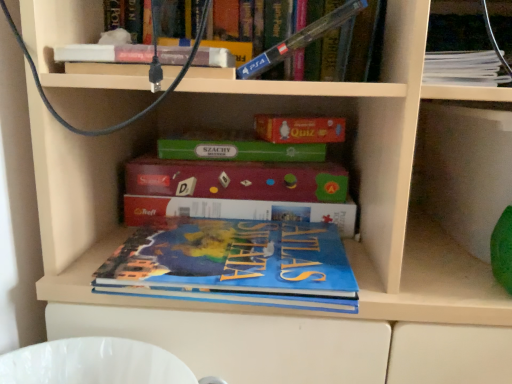
Question: Which direction should I rotate to look at blue matte atlas book at center, placed as the 1th book when sorted from bottom to top, — up or down?

Choices:
 (A) up
 (B) down

Answer: (B)

Question: Can you confirm if blue matte atlas book at center, placed as the 1th book when sorted from bottom to top, is taller than blue cardboard puzzle at center, arranged as the second book when ordered from the bottom?

Choices:
 (A) yes
 (B) no

Answer: (B)

Question: Does blue matte atlas book at center, positioned as the fourth book in top-to-bottom order, have a larger size compared to blue cardboard puzzle at center, the 3th book viewed from the top?

Choices:
 (A) no
 (B) yes

Answer: (B)

Question: Does blue matte atlas book at center, positioned as the fourth book in top-to-bottom order, come behind blue cardboard puzzle at center, the 3th book viewed from the top?

Choices:
 (A) no
 (B) yes

Answer: (A)

Question: Considering the relative sizes of blue matte atlas book at center, positioned as the fourth book in top-to-bottom order, and blue cardboard puzzle at center, the 3th book viewed from the top, in the image provided, is blue matte atlas book at center, positioned as the fourth book in top-to-bottom order, thinner than blue cardboard puzzle at center, the 3th book viewed from the top,?

Choices:
 (A) yes
 (B) no

Answer: (B)

Question: From a real-world perspective, is blue matte atlas book at center, placed as the 1th book when sorted from bottom to top, positioned under blue cardboard puzzle at center, arranged as the second book when ordered from the bottom, based on gravity?

Choices:
 (A) yes
 (B) no

Answer: (A)

Question: Is blue matte atlas book at center, placed as the 1th book when sorted from bottom to top, not within blue cardboard puzzle at center, arranged as the second book when ordered from the bottom?

Choices:
 (A) yes
 (B) no

Answer: (A)

Question: Is blue plastic ps4 controller at upper center, acting as the third book starting from the bottom, in front of white paper stack at upper right, which ranks as the fourth book in bottom-to-top order?

Choices:
 (A) yes
 (B) no

Answer: (A)

Question: Can you confirm if blue plastic ps4 controller at upper center, acting as the third book starting from the bottom, is taller than white paper stack at upper right, the 1th book viewed from the top?

Choices:
 (A) yes
 (B) no

Answer: (A)

Question: Does blue plastic ps4 controller at upper center, positioned as the second book in top-to-bottom order, appear on the right side of white paper stack at upper right, which ranks as the fourth book in bottom-to-top order?

Choices:
 (A) no
 (B) yes

Answer: (A)

Question: Is blue plastic ps4 controller at upper center, positioned as the second book in top-to-bottom order, further to the viewer compared to white paper stack at upper right, which ranks as the fourth book in bottom-to-top order?

Choices:
 (A) yes
 (B) no

Answer: (B)

Question: Can you confirm if blue plastic ps4 controller at upper center, positioned as the second book in top-to-bottom order, is wider than white paper stack at upper right, the 1th book viewed from the top?

Choices:
 (A) no
 (B) yes

Answer: (A)

Question: From the image's perspective, does blue plastic ps4 controller at upper center, positioned as the second book in top-to-bottom order, appear lower than white paper stack at upper right, which ranks as the fourth book in bottom-to-top order?

Choices:
 (A) yes
 (B) no

Answer: (A)

Question: From the image's perspective, is blue matte atlas book at center, positioned as the fourth book in top-to-bottom order, under white paper stack at upper right, the 1th book viewed from the top?

Choices:
 (A) no
 (B) yes

Answer: (B)